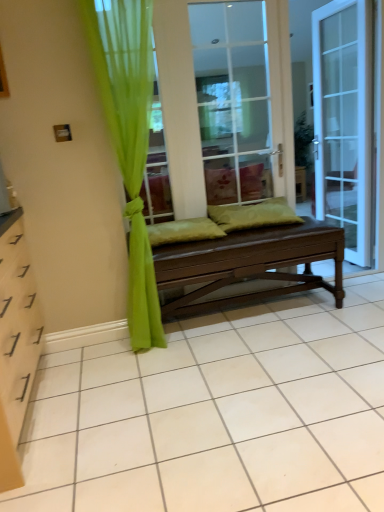
Where is `white glass door at right`? white glass door at right is located at coordinates (344, 121).

The width and height of the screenshot is (384, 512). What do you see at coordinates (236, 100) in the screenshot? I see `brown wooden bench at center` at bounding box center [236, 100].

Describe the element at coordinates (247, 265) in the screenshot. I see `matte brown bench at center` at that location.

What do you see at coordinates (183, 231) in the screenshot?
I see `green fabric pillow at center, which is the first pillow in left-to-right order` at bounding box center [183, 231].

Describe the element at coordinates (129, 139) in the screenshot. I see `green sheer curtain at left` at that location.

At what (x,y) coordinates should I click in order to perform the action: click on white glass door at right. Please return your answer as a coordinate pair (x, y). This screenshot has width=384, height=512. Looking at the image, I should click on (344, 121).

Can you tell me how much brown wooden bench at center and white glass door at right differ in facing direction?

87.4 degrees.

From the image's perspective, which object appears higher, brown wooden bench at center or white glass door at right?

white glass door at right appears higher in the image.

Between brown wooden bench at center and white glass door at right, which one appears on the right side from the viewer's perspective?

white glass door at right is more to the right.

Does white glass door at right have a lesser width compared to green fabric pillow at center, which is the first pillow in left-to-right order?

Indeed, white glass door at right has a lesser width compared to green fabric pillow at center, which is the first pillow in left-to-right order.

From a real-world perspective, is white glass door at right physically above green fabric pillow at center, which is the first pillow in left-to-right order?

Indeed, from a real-world perspective, white glass door at right stands above green fabric pillow at center, which is the first pillow in left-to-right order.

Measure the distance between white glass door at right and green fabric pillow at center, which is the first pillow in left-to-right order.

A distance of 5.07 feet exists between white glass door at right and green fabric pillow at center, which is the first pillow in left-to-right order.

Who is smaller, white glass door at right or green fabric pillow at center, which is the first pillow in left-to-right order?

green fabric pillow at center, which is the first pillow in left-to-right order, is smaller.

Considering the sizes of green fabric pillow at center, which is the first pillow in left-to-right order, and green fabric pillow at center, the first pillow when ordered from right to left, in the image, is green fabric pillow at center, which is the first pillow in left-to-right order, wider or thinner than green fabric pillow at center, the first pillow when ordered from right to left,?

green fabric pillow at center, which is the first pillow in left-to-right order, is thinner than green fabric pillow at center, the first pillow when ordered from right to left.

From a real-world perspective, is green fabric pillow at center, the second pillow viewed from the right, under green fabric pillow at center, positioned as the 2th pillow in left-to-right order?

Yes.

Does point (195, 225) come in front of point (236, 214)?

That is True.

Which object is closer to the camera taking this photo, green fabric pillow at center, which is the first pillow in left-to-right order, or green fabric pillow at center, the first pillow when ordered from right to left?

green fabric pillow at center, which is the first pillow in left-to-right order, is closer to the camera.

How far apart are matte brown bench at center and green sheer curtain at left?

matte brown bench at center and green sheer curtain at left are 25.33 inches apart from each other.

At what (x,y) coordinates should I click in order to perform the action: click on curtain on the left of the matte brown bench at center. Please return your answer as a coordinate pair (x, y). Looking at the image, I should click on (129, 139).

Is matte brown bench at center oriented away from green sheer curtain at left?

matte brown bench at center does not have its back to green sheer curtain at left.

From the image's perspective, is matte brown bench at center above or below green sheer curtain at left?

From the image's perspective, matte brown bench at center appears below green sheer curtain at left.

Does green sheer curtain at left turn towards white glass door at right?

No, green sheer curtain at left does not turn towards white glass door at right.

Between point (131, 159) and point (329, 180), which one is positioned in front?

Point (131, 159)

From the image's perspective, between green sheer curtain at left and white glass door at right, which one is located above?

white glass door at right, from the image's perspective.

Which of these two, matte brown bench at center or brown wooden bench at center, stands shorter?

Standing shorter between the two is matte brown bench at center.

From a real-world perspective, is matte brown bench at center positioned above or below brown wooden bench at center?

From a real-world perspective, matte brown bench at center is physically below brown wooden bench at center.

From the image's perspective, which is above, matte brown bench at center or brown wooden bench at center?

brown wooden bench at center, from the image's perspective.

Considering the relative sizes of green fabric pillow at center, positioned as the 2th pillow in left-to-right order, and green sheer curtain at left in the image provided, is green fabric pillow at center, positioned as the 2th pillow in left-to-right order, bigger than green sheer curtain at left?

Incorrect, green fabric pillow at center, positioned as the 2th pillow in left-to-right order, is not larger than green sheer curtain at left.

Is green fabric pillow at center, positioned as the 2th pillow in left-to-right order, taller or shorter than green sheer curtain at left?

In the image, green fabric pillow at center, positioned as the 2th pillow in left-to-right order, appears to be shorter than green sheer curtain at left.

Relative to green sheer curtain at left, is green fabric pillow at center, positioned as the 2th pillow in left-to-right order, in front or behind?

A: green fabric pillow at center, positioned as the 2th pillow in left-to-right order, is positioned farther from the viewer than green sheer curtain at left.

Which is in front, point (218, 219) or point (154, 297)?

The point (154, 297) is more forward.

I want to click on door above the brown wooden bench at center (from the image's perspective), so click(344, 121).

At what (x,y) coordinates should I click in order to perform the action: click on door on the right of green fabric pillow at center, which is the first pillow in left-to-right order. Please return your answer as a coordinate pair (x, y). The image size is (384, 512). Looking at the image, I should click on (344, 121).

When comparing their distances from matte brown bench at center, does green fabric pillow at center, positioned as the 2th pillow in left-to-right order, or green fabric pillow at center, the second pillow viewed from the right, seem further?

The object further to matte brown bench at center is green fabric pillow at center, the second pillow viewed from the right.

Estimate the real-world distances between objects in this image. Which object is closer to white glass door at right, green fabric pillow at center, which is the first pillow in left-to-right order, or matte brown bench at center?

matte brown bench at center lies closer to white glass door at right than the other object.

From the image, which object appears to be farther from matte brown bench at center, green fabric pillow at center, which is the first pillow in left-to-right order, or green fabric pillow at center, positioned as the 2th pillow in left-to-right order?

green fabric pillow at center, which is the first pillow in left-to-right order, is further to matte brown bench at center.

Looking at the image, which one is located further to green sheer curtain at left, brown wooden bench at center or matte brown bench at center?

The object further to green sheer curtain at left is brown wooden bench at center.

Which object lies further to the anchor point matte brown bench at center, brown wooden bench at center or green fabric pillow at center, positioned as the 2th pillow in left-to-right order?

Among the two, brown wooden bench at center is located further to matte brown bench at center.

Based on their spatial positions, is brown wooden bench at center or green fabric pillow at center, which is the first pillow in left-to-right order, closer to green fabric pillow at center, positioned as the 2th pillow in left-to-right order?

Based on the image, green fabric pillow at center, which is the first pillow in left-to-right order, appears to be nearer to green fabric pillow at center, positioned as the 2th pillow in left-to-right order.

Estimate the real-world distances between objects in this image. Which object is further from white glass door at right, green fabric pillow at center, the first pillow when ordered from right to left, or green sheer curtain at left?

green sheer curtain at left lies further to white glass door at right than the other object.

Estimate the real-world distances between objects in this image. Which object is closer to green fabric pillow at center, the first pillow when ordered from right to left, green fabric pillow at center, which is the first pillow in left-to-right order, or brown wooden bench at center?

green fabric pillow at center, which is the first pillow in left-to-right order, is positioned closer to the anchor green fabric pillow at center, the first pillow when ordered from right to left.

Locate an element on the screen. Image resolution: width=384 pixels, height=512 pixels. screen door between green fabric pillow at center, the second pillow viewed from the right, and green fabric pillow at center, the first pillow when ordered from right to left is located at coordinates (236, 100).

Identify the location of curtain between brown wooden bench at center and matte brown bench at center in the vertical direction. (129, 139).

I want to click on screen door between green sheer curtain at left and green fabric pillow at center, positioned as the 2th pillow in left-to-right order, from front to back, so click(236, 100).

I want to click on screen door between green fabric pillow at center, which is the first pillow in left-to-right order, and white glass door at right from left to right, so click(236, 100).